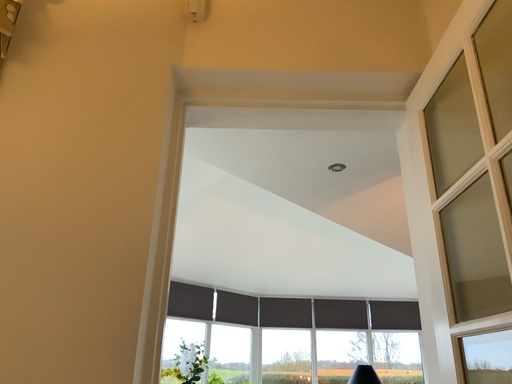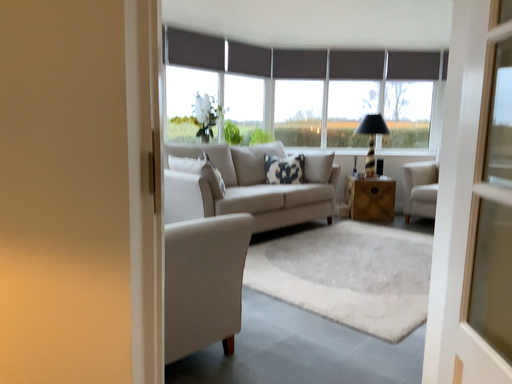
Question: How did the camera likely rotate when shooting the video?

Choices:
 (A) rotated upward
 (B) rotated downward

Answer: (B)